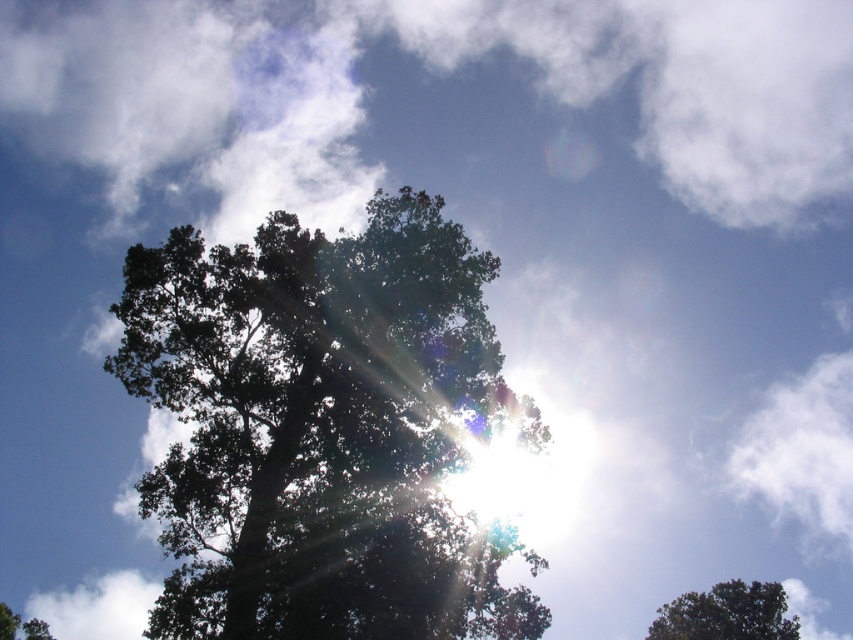
Question: Which point is closer to the camera taking this photo?

Choices:
 (A) (332, 301)
 (B) (735, 618)

Answer: (A)

Question: Can you confirm if dark green leafy tree at center is smaller than green leafy tree at lower right?

Choices:
 (A) no
 (B) yes

Answer: (A)

Question: Which object appears farthest from the camera in this image?

Choices:
 (A) green leafy tree at lower right
 (B) dark green leafy tree at center

Answer: (A)

Question: Is dark green leafy tree at center wider than green leafy tree at lower right?

Choices:
 (A) yes
 (B) no

Answer: (A)

Question: Which point appears closest to the camera in this image?

Choices:
 (A) (460, 529)
 (B) (715, 632)

Answer: (A)

Question: Considering the relative positions of dark green leafy tree at center and green leafy tree at lower right in the image provided, where is dark green leafy tree at center located with respect to green leafy tree at lower right?

Choices:
 (A) below
 (B) above

Answer: (B)